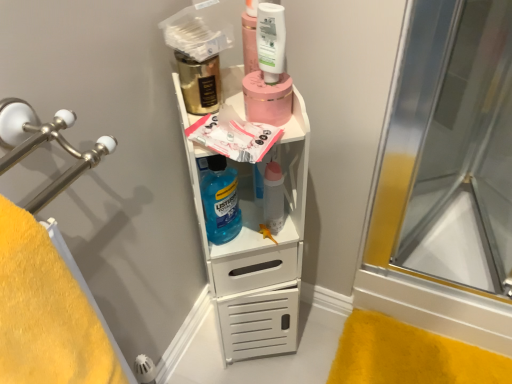
Question: From a real-world perspective, is white matte cabinet at center on top of pink matte jar at upper center?

Choices:
 (A) yes
 (B) no

Answer: (B)

Question: From the image's perspective, is white matte cabinet at center above pink matte jar at upper center?

Choices:
 (A) no
 (B) yes

Answer: (A)

Question: From the image's perspective, is white matte cabinet at center located beneath pink matte jar at upper center?

Choices:
 (A) yes
 (B) no

Answer: (A)

Question: Does white matte cabinet at center come in front of pink matte jar at upper center?

Choices:
 (A) no
 (B) yes

Answer: (B)

Question: Considering the relative sizes of white matte cabinet at center and pink matte jar at upper center in the image provided, is white matte cabinet at center shorter than pink matte jar at upper center?

Choices:
 (A) yes
 (B) no

Answer: (B)

Question: Is white matte cabinet at center positioned far away from pink matte jar at upper center?

Choices:
 (A) no
 (B) yes

Answer: (A)

Question: From a real-world perspective, does white matte cabinet at center stand above transparent glass shower door at right?

Choices:
 (A) no
 (B) yes

Answer: (A)

Question: Considering the relative sizes of white matte cabinet at center and transparent glass shower door at right in the image provided, is white matte cabinet at center thinner than transparent glass shower door at right?

Choices:
 (A) no
 (B) yes

Answer: (B)

Question: Does white matte cabinet at center come behind transparent glass shower door at right?

Choices:
 (A) yes
 (B) no

Answer: (B)

Question: Are white matte cabinet at center and transparent glass shower door at right far apart?

Choices:
 (A) no
 (B) yes

Answer: (A)

Question: Considering the relative sizes of white matte cabinet at center and transparent glass shower door at right in the image provided, is white matte cabinet at center wider than transparent glass shower door at right?

Choices:
 (A) yes
 (B) no

Answer: (B)

Question: Is white matte cabinet at center facing away from transparent glass shower door at right?

Choices:
 (A) no
 (B) yes

Answer: (A)

Question: Can we say gold metallic mouthwash at upper center, which is the 2th mouthwash from right to left, lies outside white matte cabinet at center?

Choices:
 (A) no
 (B) yes

Answer: (A)